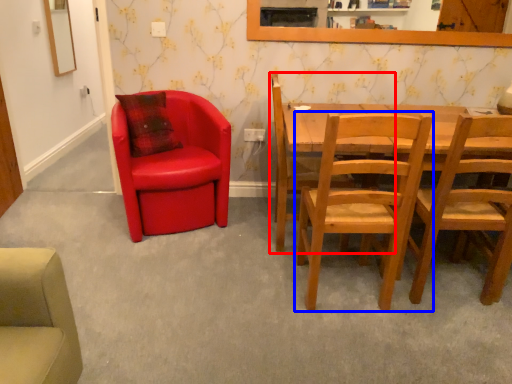
Question: Which object is closer to the camera taking this photo, chair (highlighted by a red box) or chair (highlighted by a blue box)?

Choices:
 (A) chair
 (B) chair

Answer: (B)